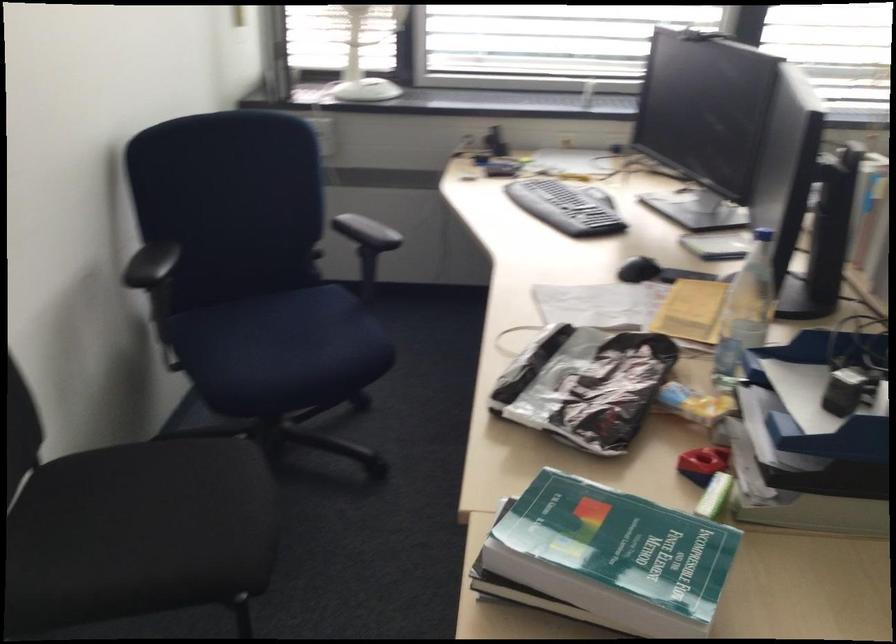
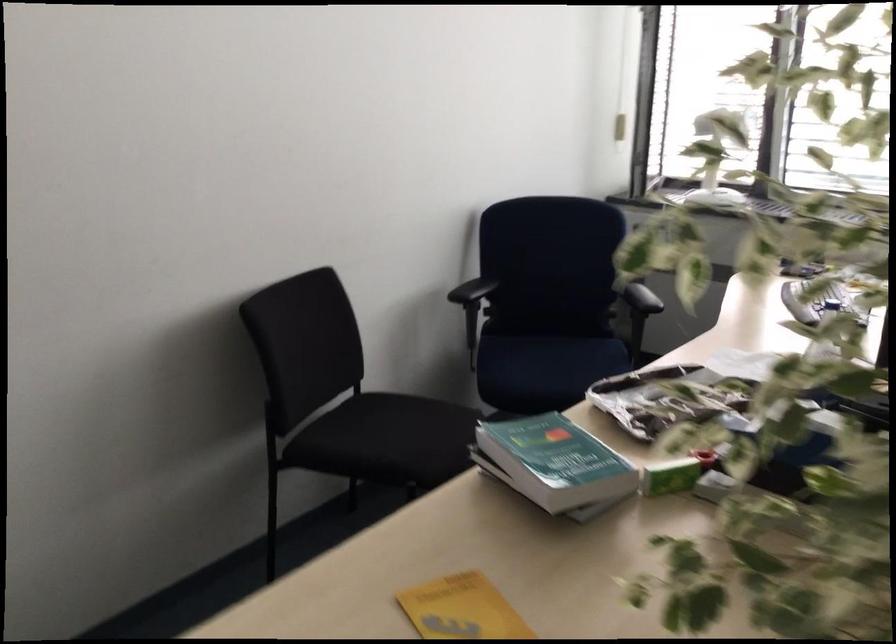
Question: The first image is from the beginning of the video and the second image is from the end. How did the camera likely rotate when shooting the video?

Choices:
 (A) Left
 (B) Right
 (C) Up
 (D) Down

Answer: (A)